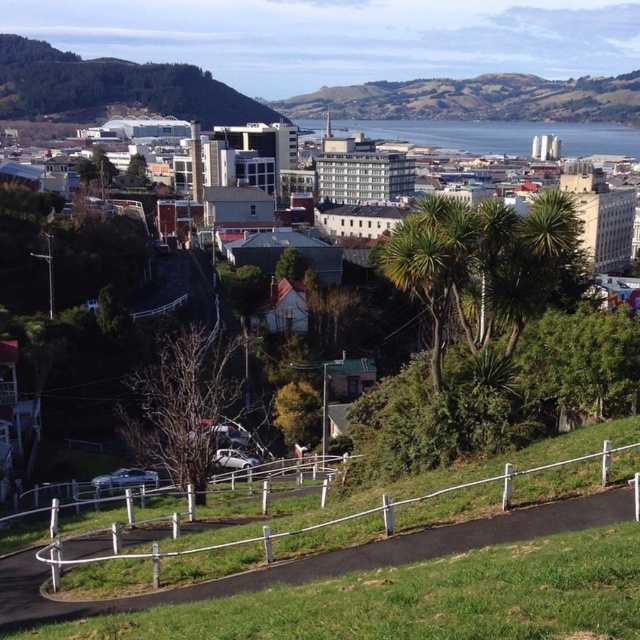
Does point (227, 618) come in front of point (220, 97)?

Yes, point (227, 618) is in front of point (220, 97).

Which of these two, green grass at lower center or green leafy hillside at upper left, stands taller?

green leafy hillside at upper left

This screenshot has width=640, height=640. What do you see at coordinates (417, 600) in the screenshot? I see `green grass at lower center` at bounding box center [417, 600].

This screenshot has height=640, width=640. In order to click on green grass at lower center in this screenshot , I will do `click(417, 600)`.

Between green grassy hillside at upper center and white metal fence at lower center, which one has less height?

white metal fence at lower center is shorter.

Where is `green grassy hillside at upper center`? The width and height of the screenshot is (640, 640). green grassy hillside at upper center is located at coordinates (477, 99).

Who is lower down, green grass at lower center or white plastic fence at center?

white plastic fence at center is below.

Who is positioned more to the right, green grass at lower center or white plastic fence at center?

green grass at lower center is more to the right.

Which is in front, point (371, 598) or point (220, 481)?

Point (371, 598) is more forward.

Identify the location of green grass at lower center. (417, 600).